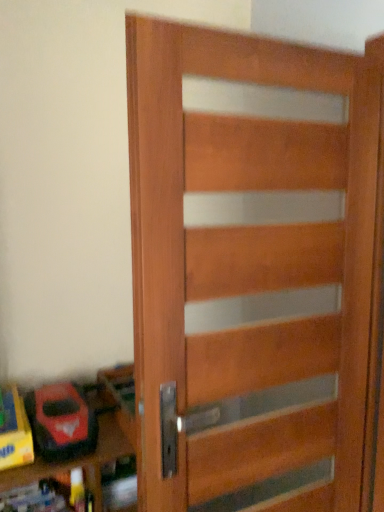
I want to click on wooden door at center, so click(250, 267).

Find the location of `rubberized red toy car at lower left`. rubberized red toy car at lower left is located at coordinates (61, 422).

Does wooden toy box at lower left have a greater width compared to wooden door at center?

Indeed, wooden toy box at lower left has a greater width compared to wooden door at center.

Considering the sizes of objects wooden toy box at lower left and wooden door at center in the image provided, who is taller, wooden toy box at lower left or wooden door at center?

wooden door at center.

How different are the orientations of wooden toy box at lower left and wooden door at center in degrees?

The facing directions of wooden toy box at lower left and wooden door at center are 1.47 degrees apart.

Is wooden toy box at lower left touching wooden door at center?

wooden toy box at lower left and wooden door at center are not in contact.

Does point (307, 446) appear closer or farther from the camera than point (29, 421)?

Point (307, 446) is closer to the camera than point (29, 421).

From the picture: Is wooden door at center taller or shorter than rubberized red toy car at lower left?

In the image, wooden door at center appears to be taller than rubberized red toy car at lower left.

Does wooden door at center have a smaller size compared to rubberized red toy car at lower left?

No.

Consider the image. Which object is thinner, wooden door at center or rubberized red toy car at lower left?

With smaller width is wooden door at center.

From the image's perspective, is rubberized red toy car at lower left located above or below wooden toy box at lower left?

rubberized red toy car at lower left is above wooden toy box at lower left.

Considering the positions of points (88, 421) and (118, 441), is point (88, 421) closer to camera compared to point (118, 441)?

Yes, it is in front of point (118, 441).

Is rubberized red toy car at lower left directly adjacent to wooden toy box at lower left?

Yes.

From a real-world perspective, who is located lower, rubberized red toy car at lower left or wooden toy box at lower left?

In real-world perspective, wooden toy box at lower left is lower.

Is wooden door at center aimed at wooden toy box at lower left?

No, wooden door at center is not aimed at wooden toy box at lower left.

What are the coordinates of `shelf on the left of wooden door at center` in the screenshot? It's located at (98, 440).

From the image's perspective, between wooden door at center and wooden toy box at lower left, who is located below?

From the image's view, wooden toy box at lower left is below.

Which is more to the right, wooden door at center or wooden toy box at lower left?

wooden door at center.

Is wooden toy box at lower left positioned with its back to rubberized red toy car at lower left?

No, wooden toy box at lower left's orientation is not away from rubberized red toy car at lower left.

Can rubberized red toy car at lower left be found inside wooden toy box at lower left?

Absolutely, rubberized red toy car at lower left is inside wooden toy box at lower left.

Visually, is wooden toy box at lower left positioned to the left or to the right of rubberized red toy car at lower left?

wooden toy box at lower left is to the right of rubberized red toy car at lower left.

Does point (84, 440) appear closer or farther from the camera than point (156, 376)?

Point (84, 440) is positioned farther from the camera compared to point (156, 376).

From the image's perspective, relative to wooden door at center, is rubberized red toy car at lower left above or below?

rubberized red toy car at lower left is situated lower than wooden door at center in the image.

Which of these two, rubberized red toy car at lower left or wooden door at center, stands shorter?

With less height is rubberized red toy car at lower left.

Locate an element on the screen. The height and width of the screenshot is (512, 384). shelf that appears below the wooden door at center (from a real-world perspective) is located at coordinates (98, 440).

The height and width of the screenshot is (512, 384). Identify the location of door above the rubberized red toy car at lower left (from a real-world perspective). (250, 267).

When comparing their distances from rubberized red toy car at lower left, does wooden toy box at lower left or wooden door at center seem closer?

wooden toy box at lower left is positioned closer to the anchor rubberized red toy car at lower left.

When comparing their distances from rubberized red toy car at lower left, does wooden door at center or wooden toy box at lower left seem further?

Among the two, wooden door at center is located further to rubberized red toy car at lower left.

When comparing their distances from wooden door at center, does wooden toy box at lower left or rubberized red toy car at lower left seem further?

Based on the image, rubberized red toy car at lower left appears to be further to wooden door at center.

When comparing their distances from wooden door at center, does rubberized red toy car at lower left or wooden toy box at lower left seem further?

Among the two, rubberized red toy car at lower left is located further to wooden door at center.

From the image, which object appears to be nearer to wooden toy box at lower left, wooden door at center or rubberized red toy car at lower left?

Based on the image, rubberized red toy car at lower left appears to be nearer to wooden toy box at lower left.

Estimate the real-world distances between objects in this image. Which object is closer to wooden toy box at lower left, rubberized red toy car at lower left or wooden door at center?

rubberized red toy car at lower left is closer to wooden toy box at lower left.

You are a GUI agent. You are given a task and a screenshot of the screen. Output one action in this format:
    pyautogui.click(x=<x>, y=<y>)
    Task: Click on the shelf between rubberized red toy car at lower left and wooden door at center
    The width and height of the screenshot is (384, 512).
    Given the screenshot: What is the action you would take?
    pyautogui.click(x=98, y=440)